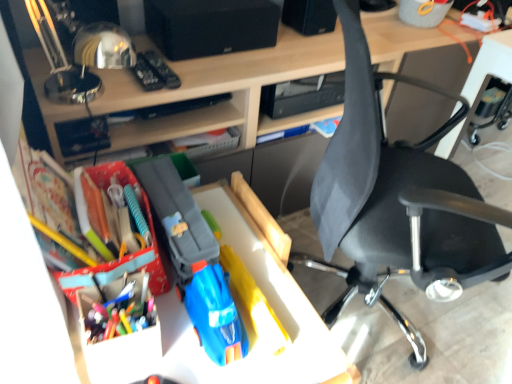
You are a GUI agent. You are given a task and a screenshot of the screen. Output one action in this format:
    pyautogui.click(x=<x>, y=<y>)
    Task: Click on the black fabric chair at right
    The width and height of the screenshot is (512, 384).
    Given the screenshot: What is the action you would take?
    pyautogui.click(x=397, y=201)

Image resolution: width=512 pixels, height=384 pixels. I want to click on matte plastic toy car at center, so click(253, 305).

What is the approximate width of multicolored plastic pen at center left?

The width of multicolored plastic pen at center left is 13.69 centimeters.

Measure the distance between point [100,334] and camera.

Point [100,334] and camera are 29.37 inches apart.

Find the location of `black fabric chair at right`. black fabric chair at right is located at coordinates (397, 201).

Is multicolored plastic pen at center left turned away from matte plastic toy car at center?

No, multicolored plastic pen at center left is not facing away from matte plastic toy car at center.

In the scene shown: Considering the relative sizes of multicolored plastic pen at center left and matte plastic toy car at center in the image provided, is multicolored plastic pen at center left wider than matte plastic toy car at center?

In fact, multicolored plastic pen at center left might be narrower than matte plastic toy car at center.

Is the position of multicolored plastic pen at center left more distant than that of matte plastic toy car at center?

Yes, multicolored plastic pen at center left is further from the camera.

From the image's perspective, is multicolored plastic pen at center left on matte plastic toy car at center?

Correct, multicolored plastic pen at center left appears higher than matte plastic toy car at center in the image.

Does black matte speaker at upper center have a greater width compared to matte plastic toy car at center?

In fact, black matte speaker at upper center might be narrower than matte plastic toy car at center.

From a real-world perspective, is black matte speaker at upper center positioned under matte plastic toy car at center based on gravity?

No, from a real-world perspective, black matte speaker at upper center is not beneath matte plastic toy car at center.

How distant is black matte speaker at upper center from matte plastic toy car at center?

A distance of 24.25 inches exists between black matte speaker at upper center and matte plastic toy car at center.

Which is correct: black matte speaker at upper center is inside matte plastic toy car at center, or outside of it?

black matte speaker at upper center is located beyond the bounds of matte plastic toy car at center.

What's the angular difference between matte plastic desk at center and black matte speaker at upper center's facing directions?

0.618 degrees separate the facing orientations of matte plastic desk at center and black matte speaker at upper center.

Does point (194, 112) come closer to viewer compared to point (213, 43)?

No, it is not.

Consider the image. Is matte plastic desk at center positioned in front of black matte speaker at upper center?

Yes, matte plastic desk at center is closer to the viewer.

Is matte plastic desk at center at the right side of black matte speaker at upper center?

Indeed, matte plastic desk at center is positioned on the right side of black matte speaker at upper center.

Who is shorter, matte plastic desk at center or black fabric chair at right?

matte plastic desk at center.

Does matte plastic desk at center come behind black fabric chair at right?

Yes, matte plastic desk at center is further from the viewer.

From a real-world perspective, relative to black fabric chair at right, is matte plastic desk at center vertically above or below?

From a real-world perspective, matte plastic desk at center is physically below black fabric chair at right.

Identify the location of desk lying on the left of black fabric chair at right. (224, 90).

Considering the relative sizes of black matte speaker at upper center and matte plastic desk at center in the image provided, is black matte speaker at upper center thinner than matte plastic desk at center?

Correct, the width of black matte speaker at upper center is less than that of matte plastic desk at center.

What's the angular difference between black matte speaker at upper center and matte plastic desk at center's facing directions?

Answer: 0.618 degrees separate the facing orientations of black matte speaker at upper center and matte plastic desk at center.

Considering the relative sizes of black matte speaker at upper center and matte plastic desk at center in the image provided, is black matte speaker at upper center bigger than matte plastic desk at center?

No, black matte speaker at upper center is not bigger than matte plastic desk at center.

Which is in front, black matte speaker at upper center or matte plastic desk at center?

matte plastic desk at center.

Is black fabric chair at right looking in the opposite direction of multicolored plastic pen at center left?

That's not correct — black fabric chair at right is not looking away from multicolored plastic pen at center left.

From a real-world perspective, is black fabric chair at right over multicolored plastic pen at center left?

Incorrect, from a real-world perspective, black fabric chair at right is lower than multicolored plastic pen at center left.

Can you confirm if black fabric chair at right is positioned to the left of multicolored plastic pen at center left?

No.

Who is bigger, black fabric chair at right or multicolored plastic pen at center left?

With larger size is black fabric chair at right.

Which is more to the left, black fabric chair at right or matte plastic desk at center?

Positioned to the left is matte plastic desk at center.

Is black fabric chair at right wider or thinner than matte plastic desk at center?

Clearly, black fabric chair at right has more width compared to matte plastic desk at center.

Between point (362, 151) and point (192, 87), which one is positioned in front?

Positioned in front is point (362, 151).

From the image's perspective, which object appears higher, black fabric chair at right or matte plastic desk at center?

matte plastic desk at center is shown above in the image.

What are the coordinates of `stationery located on the left of matte plastic toy car at center` in the screenshot? It's located at (120, 310).

Identify the location of speaker that appears above the matte plastic toy car at center (from the image's perspective). The image size is (512, 384). (210, 26).

Considering their positions, is black fabric chair at right positioned closer to matte plastic desk at center than multicolored plastic pen at center left?

black fabric chair at right is positioned closer to the anchor matte plastic desk at center.

Which object lies further to the anchor point matte plastic toy car at center, multicolored plastic pen at center left or black matte speaker at upper center?

Among the two, black matte speaker at upper center is located further to matte plastic toy car at center.

From the image, which object appears to be nearer to black matte speaker at upper center, matte plastic desk at center or black fabric chair at right?

matte plastic desk at center is closer to black matte speaker at upper center.

Which object lies nearer to the anchor point matte plastic toy car at center, black matte speaker at upper center or black fabric chair at right?

black fabric chair at right is closer to matte plastic toy car at center.

Looking at the image, which one is located closer to black fabric chair at right, matte plastic toy car at center or multicolored plastic pen at center left?

matte plastic toy car at center.

From the image, which object appears to be farther from matte plastic desk at center, multicolored plastic pen at center left or black matte speaker at upper center?

Based on the image, multicolored plastic pen at center left appears to be further to matte plastic desk at center.

When comparing their distances from black fabric chair at right, does black matte speaker at upper center or matte plastic desk at center seem further?

black matte speaker at upper center is further to black fabric chair at right.

Looking at the image, which one is located closer to matte plastic desk at center, multicolored plastic pen at center left or matte plastic toy car at center?

Based on the image, matte plastic toy car at center appears to be nearer to matte plastic desk at center.

You are a GUI agent. You are given a task and a screenshot of the screen. Output one action in this format:
    pyautogui.click(x=<x>, y=<y>)
    Task: Click on the desk situated between multicolored plastic pen at center left and black fabric chair at right from left to right
    
    Given the screenshot: What is the action you would take?
    pyautogui.click(x=224, y=90)

Locate an element on the screen. This screenshot has height=384, width=512. chair that lies between black matte speaker at upper center and multicolored plastic pen at center left from top to bottom is located at coordinates (397, 201).

In order to click on stationery between black matte speaker at upper center and matte plastic toy car at center vertically in this screenshot , I will do `click(120, 310)`.

You are a GUI agent. You are given a task and a screenshot of the screen. Output one action in this format:
    pyautogui.click(x=<x>, y=<y>)
    Task: Click on the desk between black fabric chair at right and black matte speaker at upper center along the z-axis
    The image size is (512, 384).
    Given the screenshot: What is the action you would take?
    pyautogui.click(x=224, y=90)